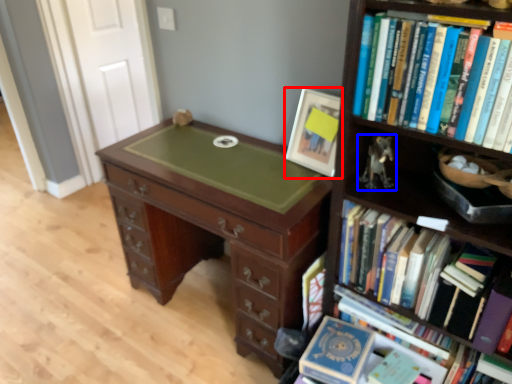
Question: Which of the following is the closest to the observer, picture frame (highlighted by a red box) or toy (highlighted by a blue box)?

Choices:
 (A) picture frame
 (B) toy

Answer: (B)